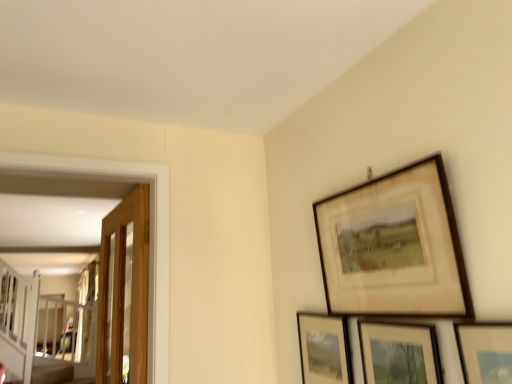
Question: Which is correct: matte wooden picture frame at lower right, the 4th picture frame viewed from the back, is inside matte black picture frame at lower right, the 4th picture frame positioned from the front, or outside of it?

Choices:
 (A) inside
 (B) outside

Answer: (B)

Question: Is matte wooden picture frame at lower right, the 4th picture frame viewed from the back, in front of or behind matte black picture frame at lower right, the 4th picture frame positioned from the front, in the image?

Choices:
 (A) behind
 (B) front

Answer: (B)

Question: Which object is positioned farthest from the matte wooden picture frame at lower right, the 4th picture frame viewed from the back?

Choices:
 (A) wooden glass door at left
 (B) matte wooden picture frame at lower right, which is the 3th picture frame in front-to-back order
 (C) wooden picture frame at upper right, which is counted as the second picture frame, starting from the front
 (D) matte black picture frame at lower right, the 4th picture frame positioned from the front

Answer: (A)

Question: Which object is the closest to the matte wooden picture frame at lower right, which is the 3th picture frame in front-to-back order?

Choices:
 (A) matte wooden picture frame at lower right, the 4th picture frame viewed from the back
 (B) wooden glass door at left
 (C) wooden picture frame at upper right, the third picture frame when ordered from back to front
 (D) matte black picture frame at lower right, acting as the first picture frame starting from the back

Answer: (A)